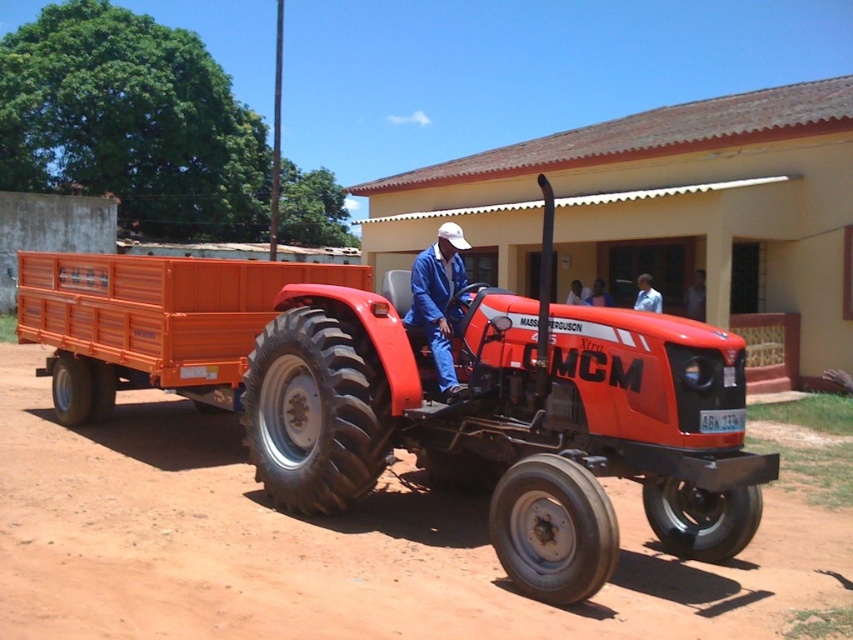
Question: Does blue denim jacket at center have a larger size compared to blue fabric shirt at center?

Choices:
 (A) no
 (B) yes

Answer: (A)

Question: Which of the following is the closest to the observer?

Choices:
 (A) (28, 282)
 (B) (25, 310)

Answer: (A)

Question: Is the position of orange plastic wagon at center less distant than that of blue denim jacket at center?

Choices:
 (A) yes
 (B) no

Answer: (B)

Question: Based on their relative distances, which object is farther from the blue denim jacket at center?

Choices:
 (A) blue fabric shirt at center
 (B) orange plastic wagon at center
 (C) matte orange trailer at center

Answer: (A)

Question: Does orange plastic wagon at center appear under blue fabric shirt at center?

Choices:
 (A) yes
 (B) no

Answer: (B)

Question: Estimate the real-world distances between objects in this image. Which object is closer to the matte orange trailer at center?

Choices:
 (A) orange plastic wagon at center
 (B) blue denim jacket at center

Answer: (A)